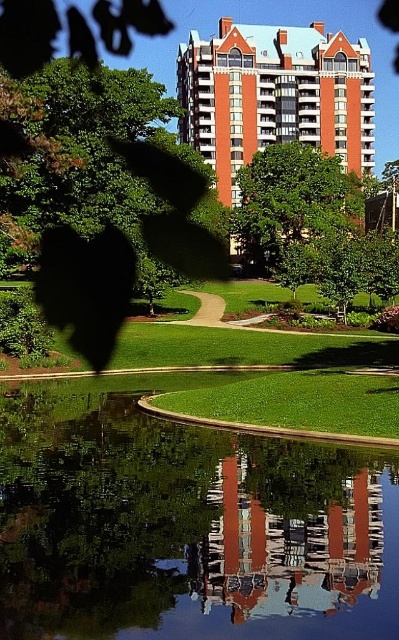
You are standing at the point marked by point (274, 97) in the park. What structure is directly in front of you?

The point (274, 97) marks the orange brick building at center, so the structure directly in front of you is the orange brick building at center.